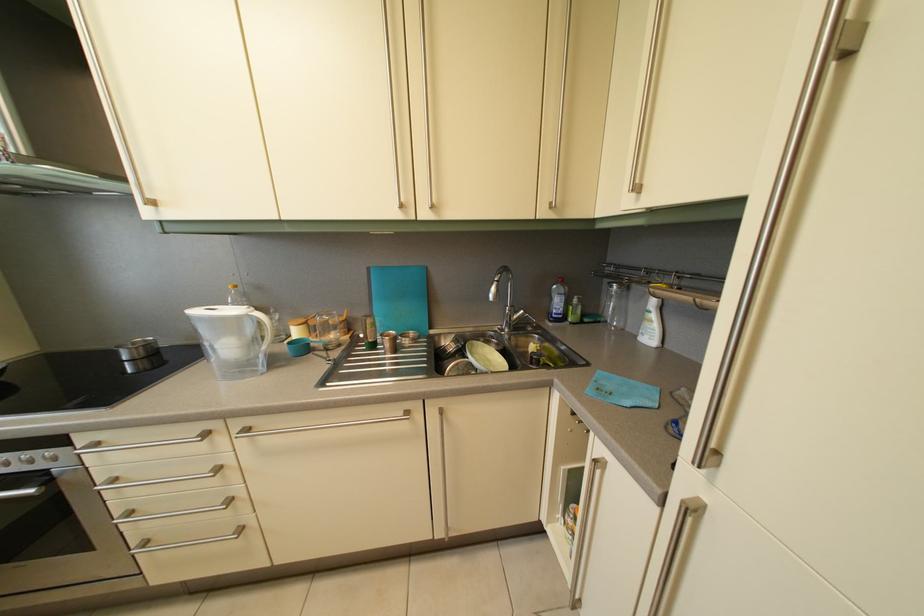
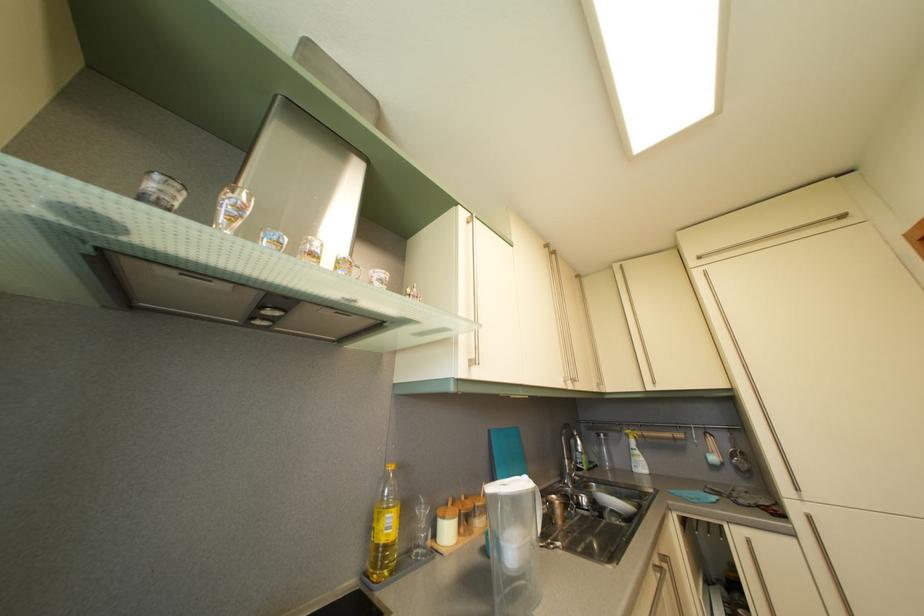
Where in the second image is the point corresponding to the point at 377,276 from the first image?

(497, 439)